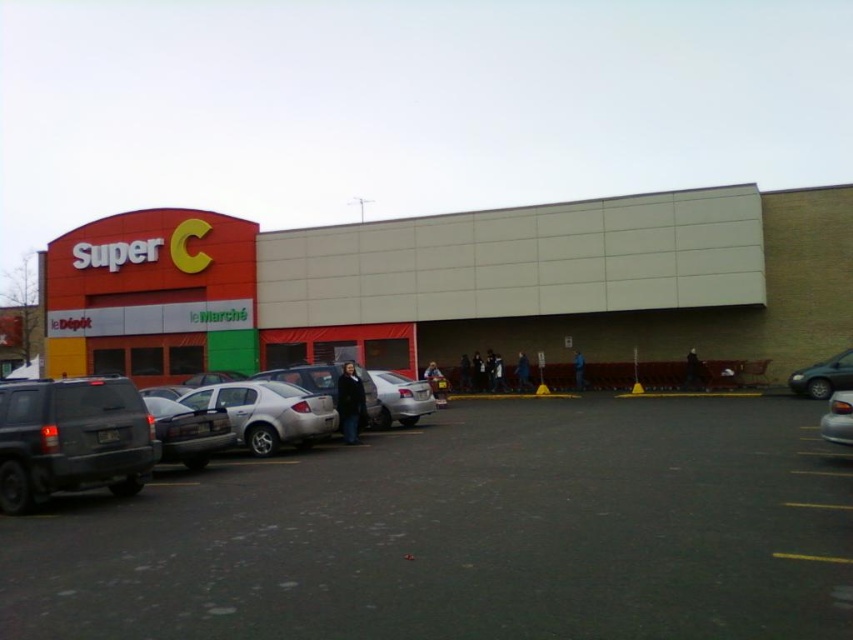
You are a delivery person standing in front of the Super C building. You need to place a package on the ground between the dark gray jacket at center and the dark blue jeans at lower right. Which side should you choose to ensure the package fits without overlapping either item?

The dark gray jacket at center is narrower than the dark blue jeans at lower right. To ensure the package fits without overlapping, place it on the side of the dark gray jacket at center since it has less width.

You are standing in front of the Super C building and want to locate two points marked on the parking lot. The first point is at coordinates point (688, 355) and the second point is at point (573, 369). Which point is closer to you?

Point (688, 355) is closer to the viewer than point (573, 369).

You are standing at the entrance of the Super C building and need to reach the dark blue jeans at lower right. The dark gray jacket at center is blocking your path. Can you walk around it without getting closer than 1 meter to the jacket?

The dark gray jacket at center is 17.64 meters away from the dark blue jeans at lower right. Since the jacket is blocking your path, you can walk around it while maintaining a distance of at least 1 meter because the distance between them allows for a detour without getting too close.